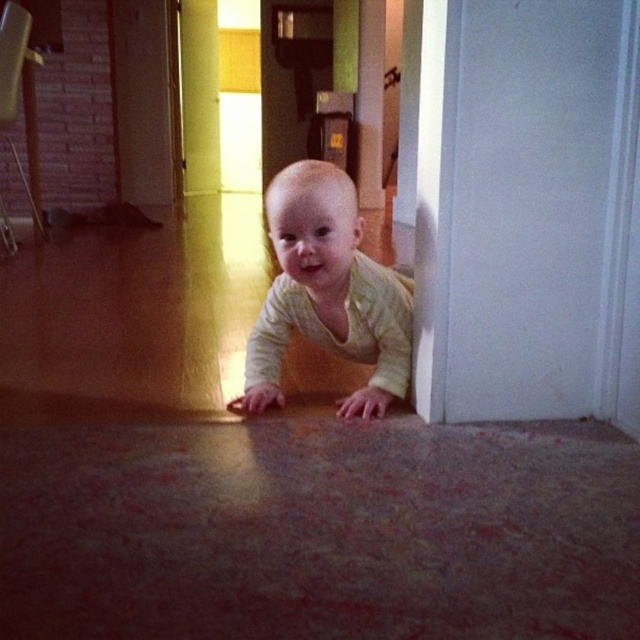
Question: Can you confirm if light yellow striped shirt at center is wider than matte yellow door at upper left?

Choices:
 (A) yes
 (B) no

Answer: (A)

Question: Which point appears farthest from the camera in this image?

Choices:
 (A) (157, 140)
 (B) (337, 248)

Answer: (A)

Question: Among these points, which one is farthest from the camera?

Choices:
 (A) (145, 202)
 (B) (360, 417)

Answer: (A)

Question: Can you confirm if light yellow striped shirt at center is positioned to the left of matte yellow door at upper left?

Choices:
 (A) yes
 (B) no

Answer: (B)

Question: Which object is farther from the camera taking this photo?

Choices:
 (A) light yellow striped shirt at center
 (B) matte yellow door at upper left

Answer: (B)

Question: Is light yellow striped shirt at center below matte yellow door at upper left?

Choices:
 (A) no
 (B) yes

Answer: (B)